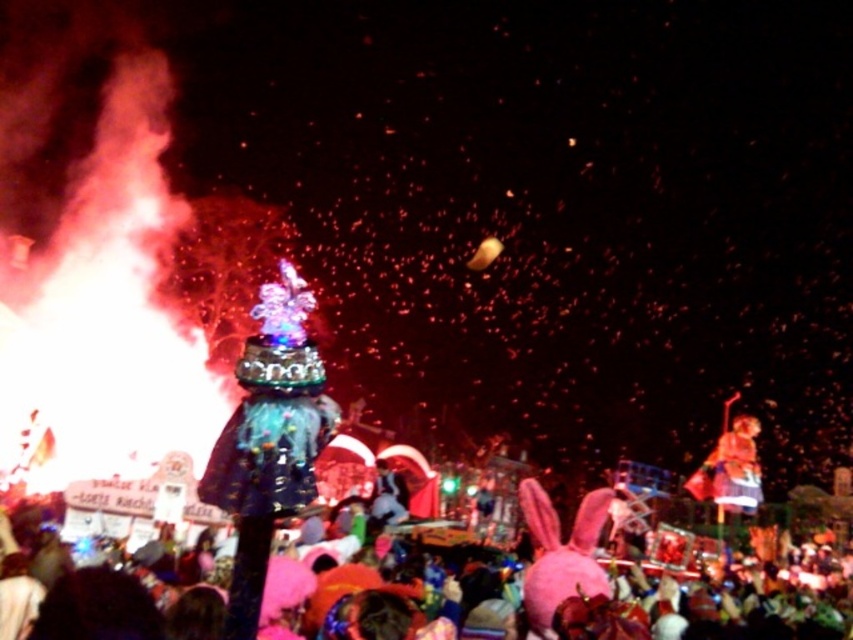
You are a drone operator tasked with capturing aerial footage of the pink fabric crowd at lower center and the shiny gold statue at right. The drone has a maximum flight range of 30 meters. Can the drone safely capture footage of both objects without exceeding its range limit?

The distance between the pink fabric crowd at lower center and the shiny gold statue at right is 31.43 meters. Since the drone can only fly up to 30 meters, it cannot safely capture footage of both objects without exceeding its range limit.

You are a photographer trying to capture both the pink fabric crowd at lower center and the shiny gold statue at right in a single shot. Based on their heights, which object should you focus on first to ensure both are in frame?

The pink fabric crowd at lower center has a greater height compared to the shiny gold statue at right, so you should focus on the pink fabric crowd at lower center first to ensure both are in frame.